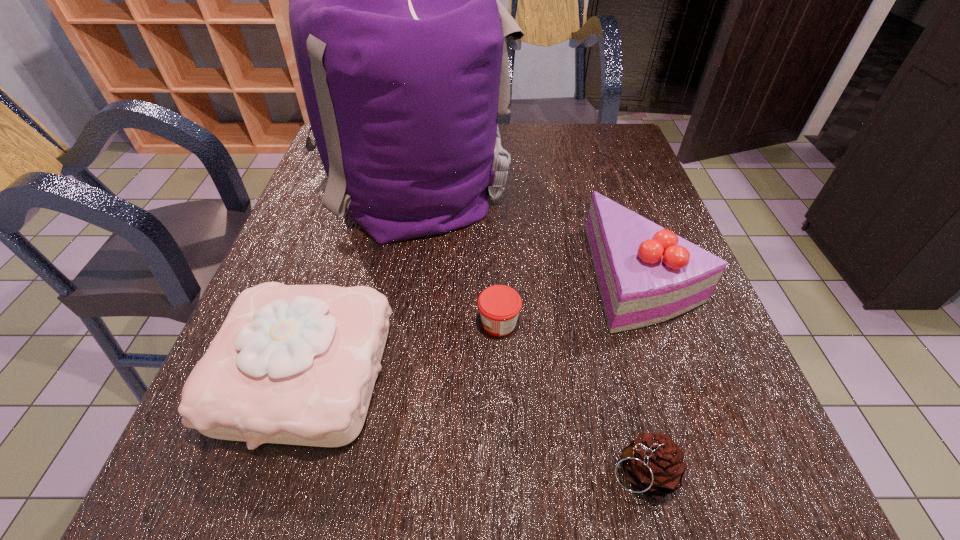
Identify the location of object that is the second closest one to the third shortest object. The height and width of the screenshot is (540, 960). (401, 43).

Where is `vacant region that satisfies the following two spatial constraints: 1. on the front side of the taller cake; 2. on the label side of the jam`? vacant region that satisfies the following two spatial constraints: 1. on the front side of the taller cake; 2. on the label side of the jam is located at coordinates (660, 323).